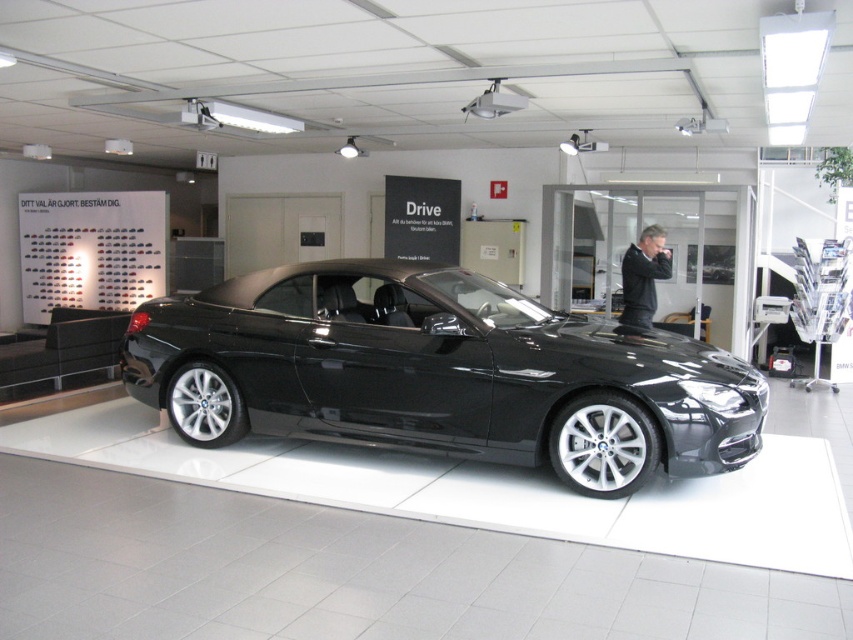
Question: Does glossy black convertible at center appear under black leather jacket at center?

Choices:
 (A) yes
 (B) no

Answer: (A)

Question: Is glossy black convertible at center smaller than black leather jacket at center?

Choices:
 (A) yes
 (B) no

Answer: (B)

Question: In this image, where is glossy black convertible at center located relative to black leather jacket at center?

Choices:
 (A) above
 (B) below

Answer: (B)

Question: Which of the following is the closest to the observer?

Choices:
 (A) black leather jacket at center
 (B) glossy black convertible at center

Answer: (B)

Question: Which point is closer to the camera?

Choices:
 (A) black leather jacket at center
 (B) glossy black convertible at center

Answer: (B)